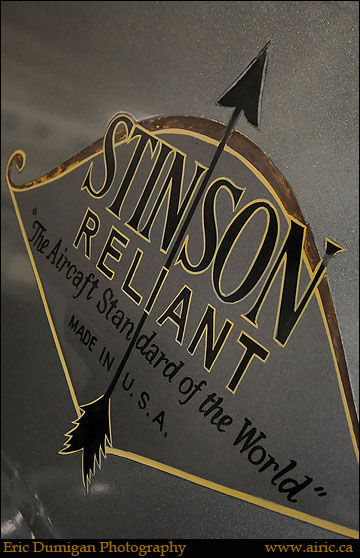
Identify the location of wall. (310, 73), (320, 445).